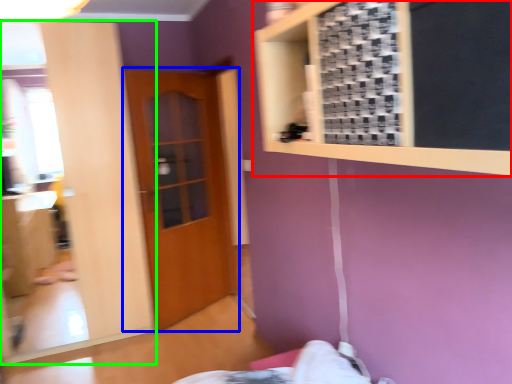
Question: Based on their relative distances, which object is farther from bulletin board (highlighted by a red box)? Choose from door (highlighted by a blue box) and mirror (highlighted by a green box).

Choices:
 (A) door
 (B) mirror

Answer: (A)